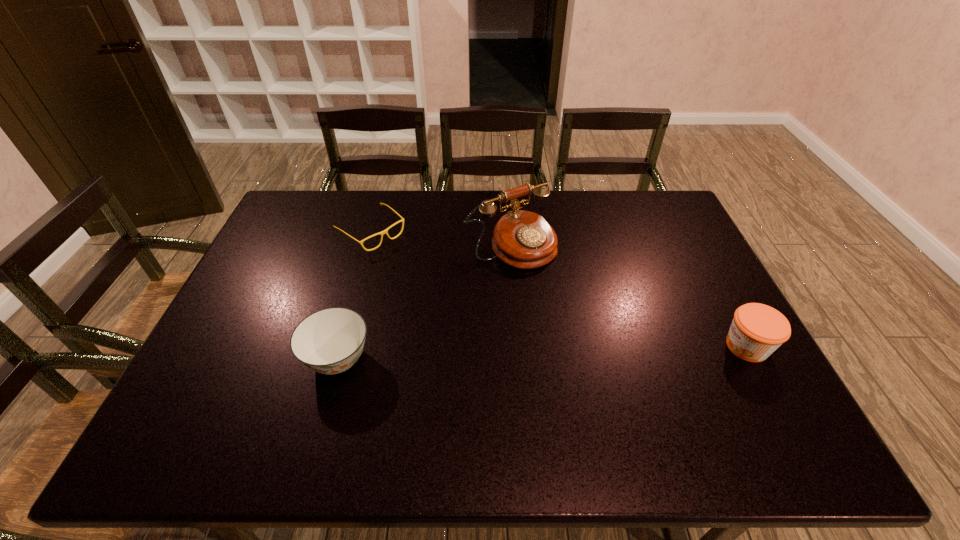
Where is `free space at the left edge of the desktop`? Image resolution: width=960 pixels, height=540 pixels. free space at the left edge of the desktop is located at coordinates (266, 326).

Where is `free space at the right edge of the desktop`? The width and height of the screenshot is (960, 540). free space at the right edge of the desktop is located at coordinates (655, 250).

You are a GUI agent. You are given a task and a screenshot of the screen. Output one action in this format:
    pyautogui.click(x=<x>, y=<y>)
    Task: Click on the vacant space at the far left corner of the desktop
    
    Given the screenshot: What is the action you would take?
    (303, 215)

Image resolution: width=960 pixels, height=540 pixels. What are the coordinates of `free space at the near left corner of the desktop` in the screenshot? It's located at (203, 390).

Where is `blank space at the far right corner of the desktop`? The height and width of the screenshot is (540, 960). blank space at the far right corner of the desktop is located at coordinates (652, 201).

What are the coordinates of `vacant region at the near right corner of the desktop` in the screenshot? It's located at (710, 387).

In order to click on unoccupied position between the spectacles and the rightmost object in this screenshot , I will do point(559,289).

The image size is (960, 540). Identify the location of vacant area that lies between the tallest object and the jam. (629, 296).

Where is `free space between the tallest object and the soup bowl`? This screenshot has width=960, height=540. free space between the tallest object and the soup bowl is located at coordinates (424, 302).

At what (x,y) coordinates should I click in order to perform the action: click on empty space that is in between the soup bowl and the shortest object. Please return your answer as a coordinate pair (x, y). The width and height of the screenshot is (960, 540). Looking at the image, I should click on (354, 295).